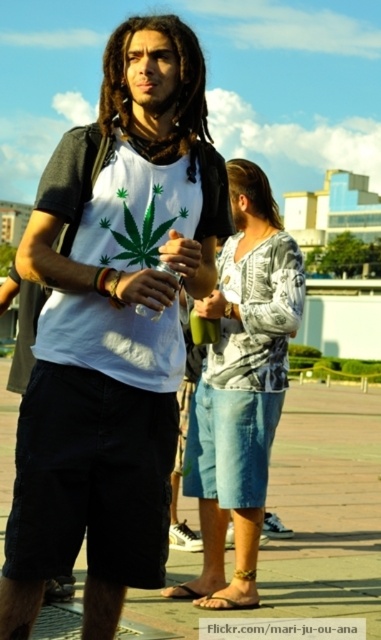
You are standing at the point marked by the coordinates point [241,387] in the image. What object is located exactly at that point?

The point [241,387] marks denim shorts at center.

You are a photographer trying to capture both the brown brick pavement at center and the brown wavy hair at upper center in a single shot. Which object should you focus on first to ensure both are in frame?

You should focus on the brown brick pavement at center first since it is larger in size than the brown wavy hair at upper center, making it easier to frame both objects together.